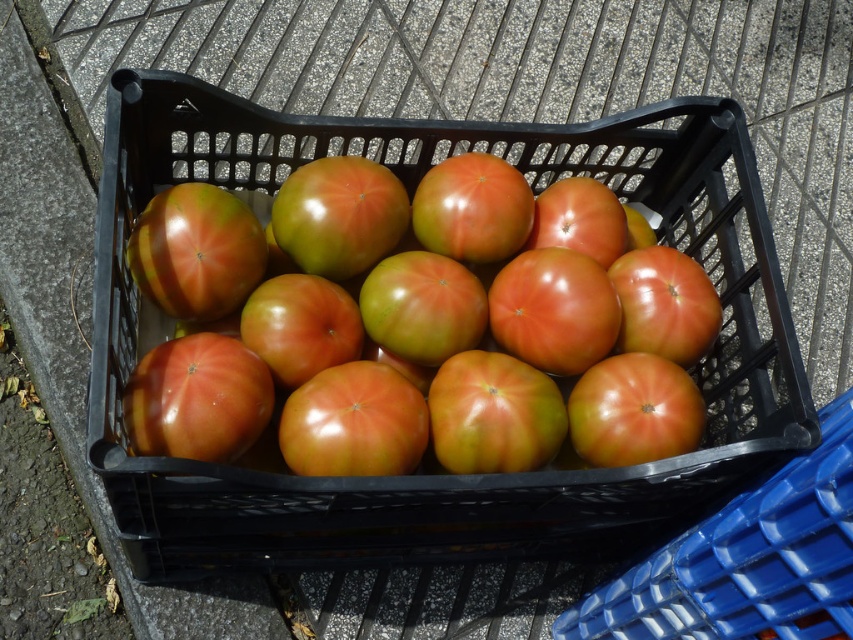
Who is more distant from viewer, (193, 552) or (201, 305)?

The point (193, 552) is behind.

Is point (444, 506) in front of point (213, 269)?

No, it is behind (213, 269).

At what (x,y) coordinates should I click in order to perform the action: click on matte black basket at center. Please return your answer as a coordinate pair (x, y). This screenshot has height=640, width=853. Looking at the image, I should click on (428, 456).